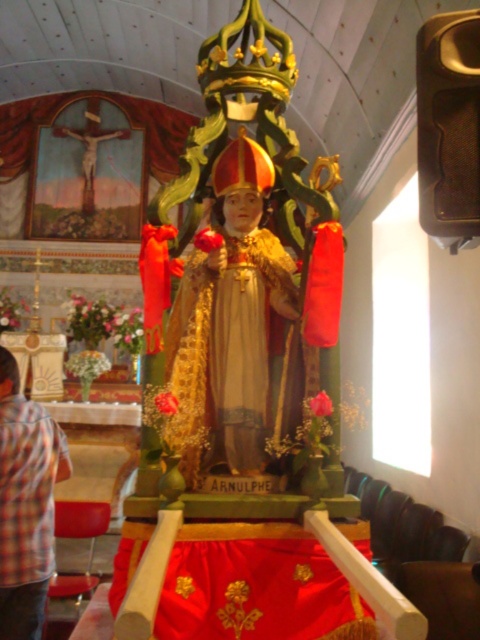
Is gold textured statue at center shorter than plaid shirt at lower left?

No.

Describe the element at coordinates (230, 321) in the screenshot. This screenshot has height=640, width=480. I see `gold textured statue at center` at that location.

I want to click on gold textured statue at center, so click(230, 321).